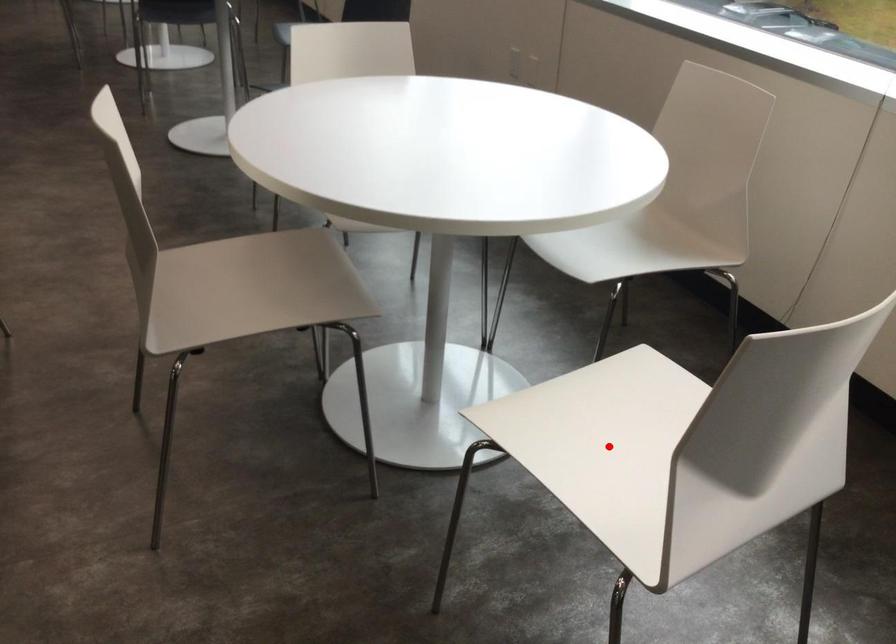
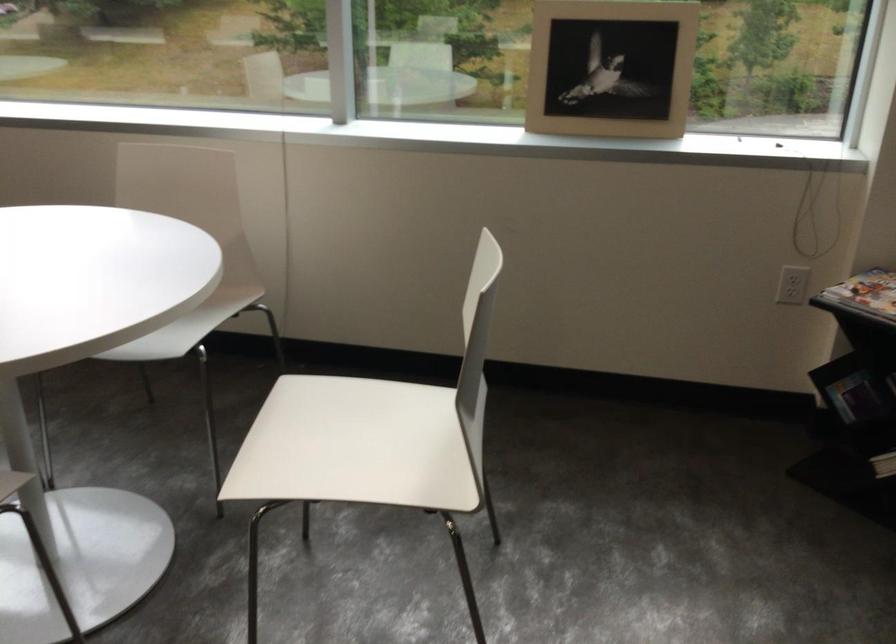
Where in the second image is the point corresponding to the highlighted location from the first image?

(356, 446)